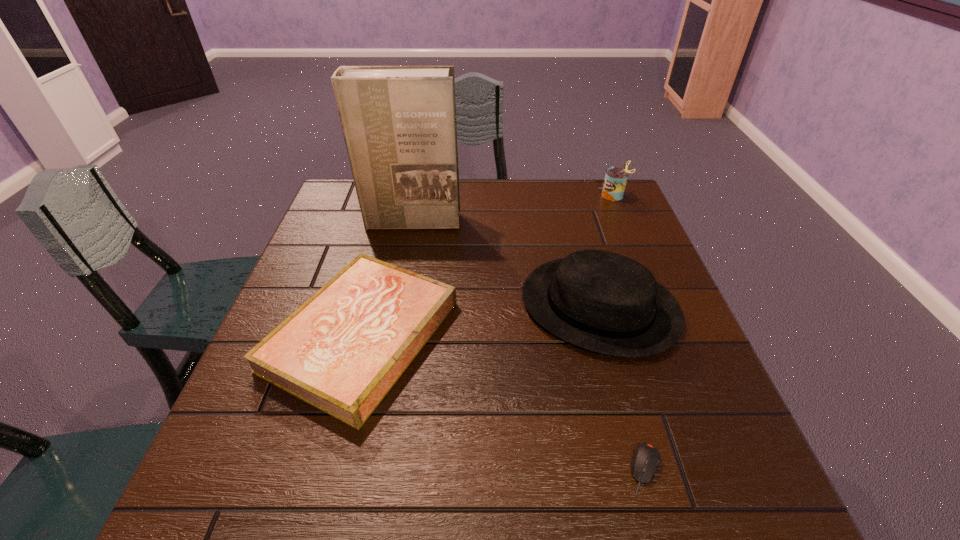
Where is `object that is at the far left corner`? This screenshot has height=540, width=960. object that is at the far left corner is located at coordinates (399, 124).

Identify the location of object that is at the far right corner. The width and height of the screenshot is (960, 540). pos(614,184).

This screenshot has width=960, height=540. I want to click on object that is at the near right corner, so click(646, 459).

The image size is (960, 540). Find the location of `free space at the far edge of the desktop`. free space at the far edge of the desktop is located at coordinates (529, 199).

What are the coordinates of `vacant space at the near edge of the desktop` in the screenshot? It's located at (503, 520).

The image size is (960, 540). What are the coordinates of `blank space at the left edge` in the screenshot? It's located at (272, 417).

Find the location of a particular element. The width and height of the screenshot is (960, 540). free space at the right edge of the desktop is located at coordinates (725, 421).

The height and width of the screenshot is (540, 960). Find the location of `vacant space at the far left corner of the desktop`. vacant space at the far left corner of the desktop is located at coordinates (331, 209).

Find the location of a particular element. This screenshot has height=540, width=960. vacant space at the near left corner of the desktop is located at coordinates (236, 517).

This screenshot has width=960, height=540. In the image, there is a desktop. Find the location of `free region at the far right corner`. free region at the far right corner is located at coordinates (632, 210).